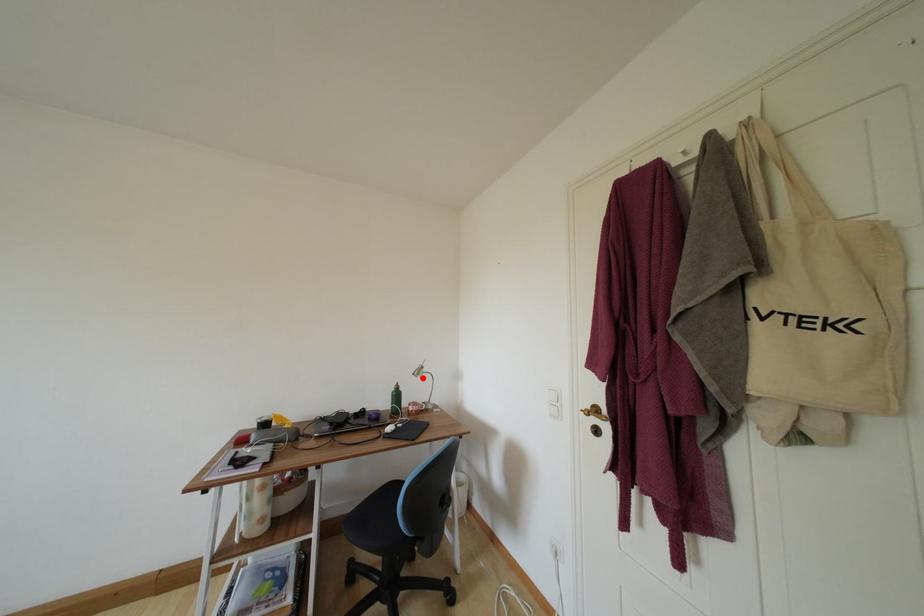
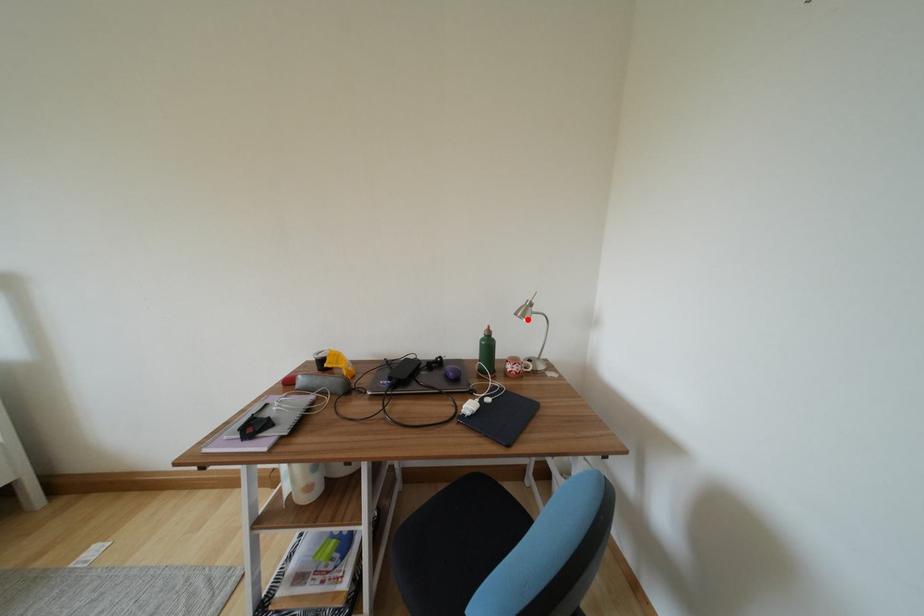
I am providing you with two images of the same scene from different viewpoints. A red point is marked on the first image and another point is marked on the second image. Is the marked point in image1 the same physical position as the marked point in image2?

Yes